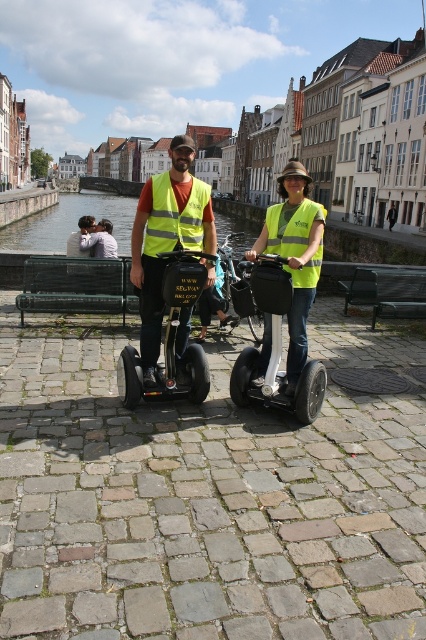
You are a pedestrian standing on the sidewalk near the canal. You see the yellow reflective vest at center and the black rubber segway at center. Which object is closer to your right side?

The yellow reflective vest at center is to the right of the black rubber segway at center, so the yellow reflective vest at center is closer to your right side.

You are a pedestrian crossing the street and see the yellow reflective vest at center and the black rubber segway at center. Which object is closer to you?

The yellow reflective vest at center is closer to you because the black rubber segway at center is behind it.